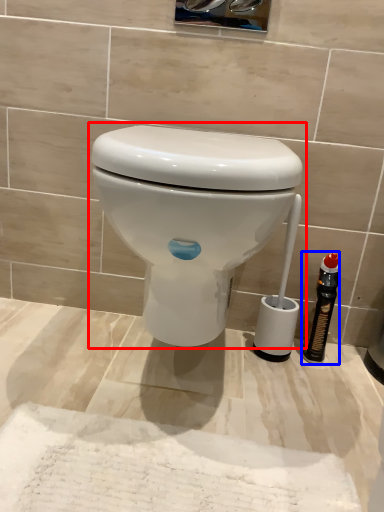
Question: Which of the following is the closest to the observer, toilet (highlighted by a red box) or bottle (highlighted by a blue box)?

Choices:
 (A) toilet
 (B) bottle

Answer: (A)